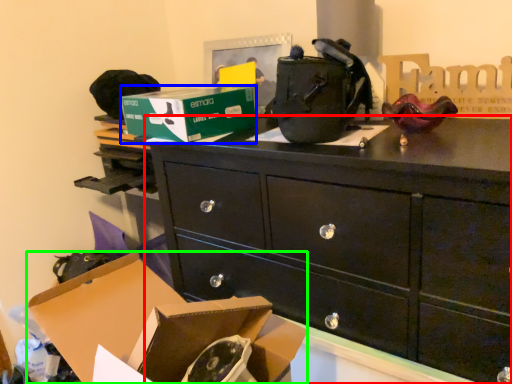
Question: Which object is the closest to the chest of drawers (highlighted by a red box)? Choose among these: box (highlighted by a blue box) or box (highlighted by a green box).

Choices:
 (A) box
 (B) box

Answer: (A)